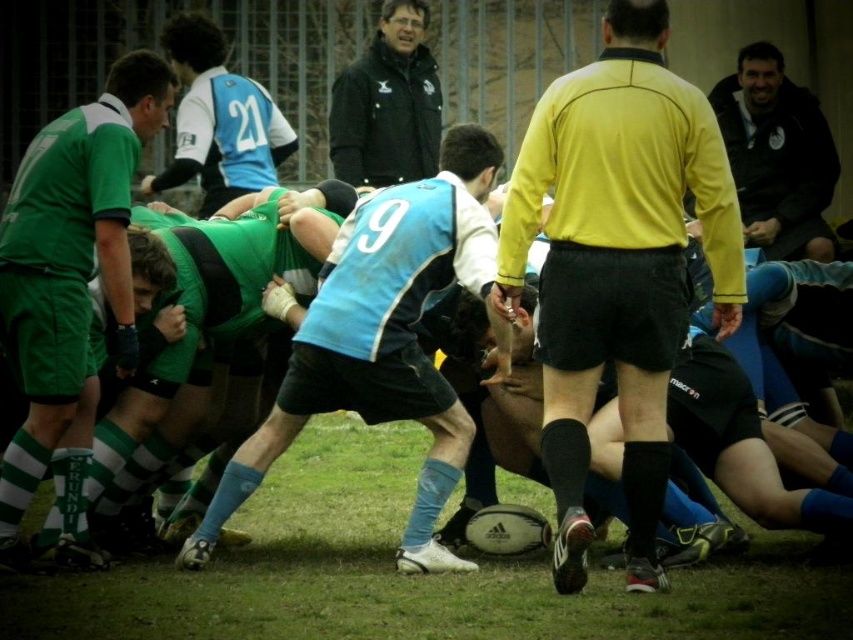
A drone is flying overhead and needs to capture a clear photo of both the yellow matte shirt at center and the black leather jacket at upper right in the same frame. The camera has a maximum focal length that allows capturing objects up to 60 feet apart. Will the drone be able to include both objects in one photo?

The yellow matte shirt at center and the black leather jacket at upper right are 63.12 feet apart, which exceeds the camera maximum focal length of 60 feet. The drone will not be able to include both objects in one photo.

You are a spectator at the rugby match and want to take a photo of the blue jersey at center without the black jacket at upper center blocking the view. Is this possible?

The blue jersey at center is in front of the black jacket at upper center, so taking a photo of the blue jersey at center without the black jacket at upper center blocking the view is possible.

You are a photographer at the rugby match and want to capture a photo that includes both the yellow matte shirt at center and the black leather jacket at upper right. Based on their positions, which object should you focus on first to ensure both are in frame?

The yellow matte shirt at center is below the black leather jacket at upper right, so you should focus on the black leather jacket at upper right first to ensure both are in frame.